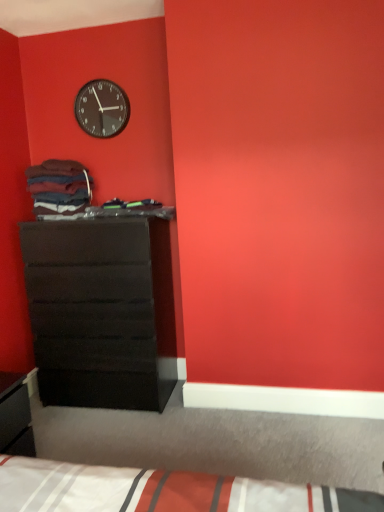
Question: Does white striped fabric bed at lower center have a lesser height compared to matte black clock at upper left?

Choices:
 (A) yes
 (B) no

Answer: (A)

Question: From the image's perspective, is white striped fabric bed at lower center on top of matte black clock at upper left?

Choices:
 (A) no
 (B) yes

Answer: (A)

Question: From a real-world perspective, is white striped fabric bed at lower center over matte black clock at upper left?

Choices:
 (A) no
 (B) yes

Answer: (A)

Question: Could matte black clock at upper left be considered to be inside white striped fabric bed at lower center?

Choices:
 (A) yes
 (B) no

Answer: (B)

Question: From a real-world perspective, is white striped fabric bed at lower center beneath matte black clock at upper left?

Choices:
 (A) yes
 (B) no

Answer: (A)

Question: Can you confirm if white striped fabric bed at lower center is bigger than matte black clock at upper left?

Choices:
 (A) no
 (B) yes

Answer: (B)

Question: From the image's perspective, is white striped fabric bed at lower center located beneath matte black chest of drawers at left?

Choices:
 (A) no
 (B) yes

Answer: (B)

Question: Considering the relative sizes of white striped fabric bed at lower center and matte black chest of drawers at left in the image provided, is white striped fabric bed at lower center thinner than matte black chest of drawers at left?

Choices:
 (A) yes
 (B) no

Answer: (B)

Question: Does white striped fabric bed at lower center have a lesser height compared to matte black chest of drawers at left?

Choices:
 (A) yes
 (B) no

Answer: (A)

Question: Does white striped fabric bed at lower center have a greater height compared to matte black chest of drawers at left?

Choices:
 (A) no
 (B) yes

Answer: (A)

Question: Does white striped fabric bed at lower center contain matte black chest of drawers at left?

Choices:
 (A) yes
 (B) no

Answer: (B)

Question: From a real-world perspective, is white striped fabric bed at lower center positioned under matte black chest of drawers at left based on gravity?

Choices:
 (A) yes
 (B) no

Answer: (A)

Question: From the image's perspective, is matte black clock at upper left under matte black chest of drawers at left?

Choices:
 (A) yes
 (B) no

Answer: (B)